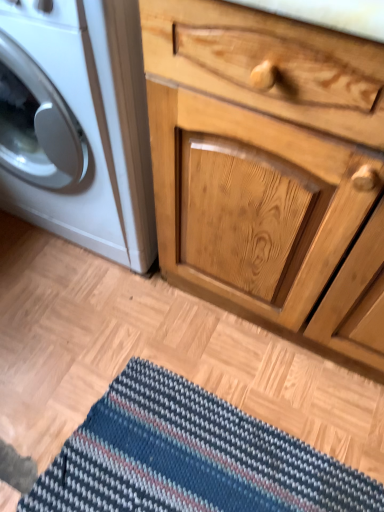
Locate an element on the screen. The image size is (384, 512). vacant region above striped fabric doormat at lower center (from a real-world perspective) is located at coordinates (105, 422).